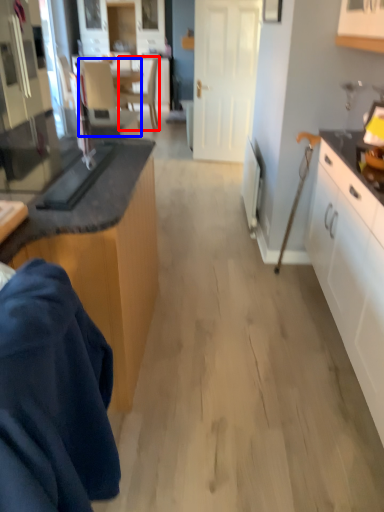
Question: Which point is further to the camera, chair (highlighted by a red box) or armchair (highlighted by a blue box)?

Choices:
 (A) chair
 (B) armchair

Answer: (A)